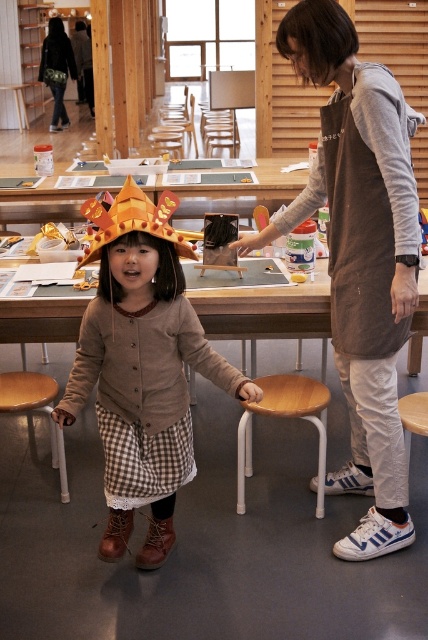
Which is more to the right, gray cotton apron at center or wooden stool at lower left?

gray cotton apron at center is more to the right.

Who is more distant from viewer, (412, 227) or (17, 397)?

The point (17, 397) is behind.

Which is in front, point (371, 243) or point (59, 456)?

Point (371, 243) is more forward.

Locate an element on the screen. gray cotton apron at center is located at coordinates (359, 256).

Can you confirm if matte orange paper crown at center is wider than wooden stool at lower left?

Indeed, matte orange paper crown at center has a greater width compared to wooden stool at lower left.

Is point (183, 451) farther from viewer compared to point (15, 400)?

No, (183, 451) is in front of (15, 400).

Locate an element on the screen. This screenshot has width=428, height=640. matte orange paper crown at center is located at coordinates coord(142,368).

Which is behind, point (0, 340) or point (0, 392)?

Positioned behind is point (0, 340).

How distant is wooden table at center from wooden stool at lower left?

wooden table at center and wooden stool at lower left are 36.80 inches apart.

In order to click on wooden table at center in this screenshot , I will do `click(265, 312)`.